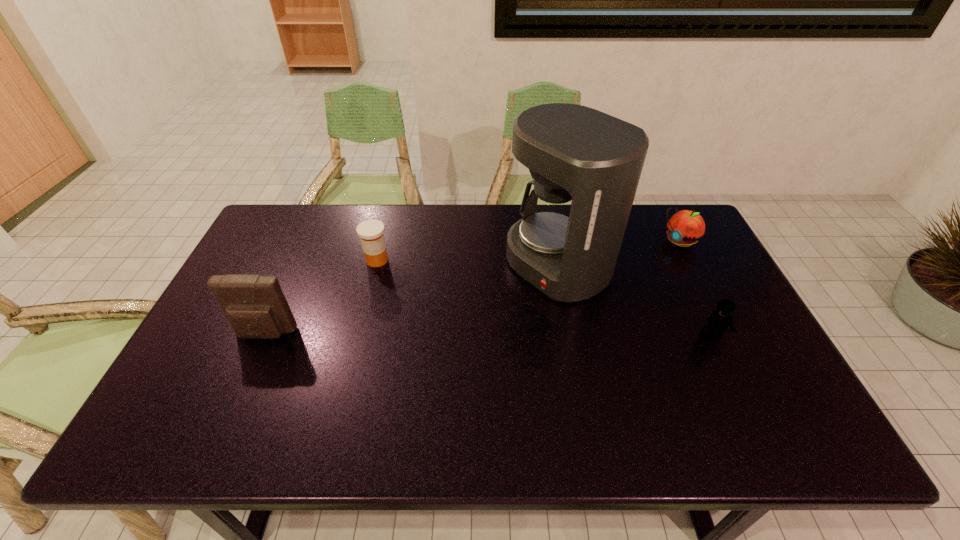
Locate an element on the screen. free space located 0.350m on the label of the second object from left to right is located at coordinates click(456, 333).

Find the location of a particular element. blank space located on the label of the second object from left to right is located at coordinates (410, 291).

This screenshot has width=960, height=540. Identify the location of blank space located 0.260m on the front-facing side of the tallest object. (451, 336).

Image resolution: width=960 pixels, height=540 pixels. What are the coordinates of `vacant region located 0.070m on the front-facing side of the tallest object` in the screenshot? It's located at (504, 302).

The image size is (960, 540). In order to click on blank space located 0.240m on the front-facing side of the tallest object in this screenshot , I will do point(457,333).

At what (x,y) coordinates should I click in order to perform the action: click on vacant space situated on the surface of the apple. Please return your answer as a coordinate pair (x, y). Looking at the image, I should click on (630, 278).

Find the location of a particular element. The width and height of the screenshot is (960, 540). free region located on the surface of the apple is located at coordinates (634, 275).

Locate an element on the screen. The height and width of the screenshot is (540, 960). blank space located on the surface of the apple is located at coordinates (619, 286).

You are a GUI agent. You are given a task and a screenshot of the screen. Output one action in this format:
    pyautogui.click(x=<x>, y=<y>)
    Task: Click on the coffee maker located in the far edge section of the desktop
    Image resolution: width=960 pixels, height=540 pixels.
    Given the screenshot: What is the action you would take?
    [x=586, y=165]

At what (x,y) coordinates should I click in order to perform the action: click on apple positioned at the far edge. Please return your answer as a coordinate pair (x, y). Looking at the image, I should click on (685, 227).